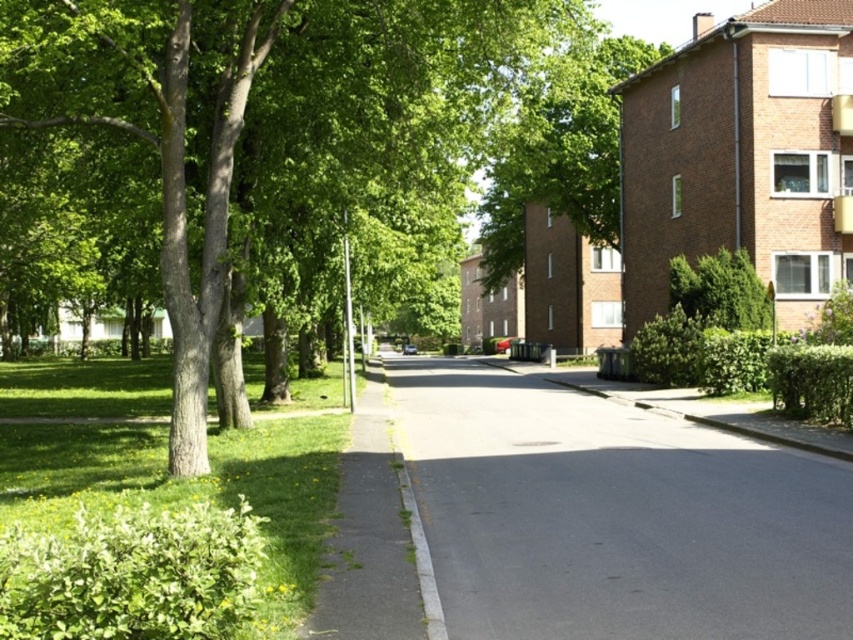
You are standing on the sidewalk and want to walk towards the green leafy tree at upper center. However, there is a green leafy tree at left in your path. Can you walk straight ahead without going around it?

The green leafy tree at left is positioned under the green leafy tree at upper center, so you can walk straight ahead because the tree at left is directly below the upper tree and not blocking your path.

You are standing on the sidewalk and want to cross the street to reach the buildings on the right. If your walking speed is 1.2 meters per second, how many seconds will it take you to reach the asphalt road at center from your current position?

The asphalt road at center is 5.43 meters away from the viewer. At a walking speed of 1.2 meters per second, it would take approximately 4.525 seconds to reach the asphalt road at center.

You are a delivery driver planning to turn right onto the residential street. You need to ensure your truck, which is 10 feet wide, can safely navigate the asphalt road at center. Considering the green leafy tree at upper center, is there enough space for your truck to pass without hitting the tree?

The asphalt road at center is smaller than the green leafy tree at upper center. Since the road is narrower than the tree, it might not provide sufficient width for a 10 feet wide truck to pass safely without hitting the tree. It is advisable to check the exact measurements or seek an alternative route.